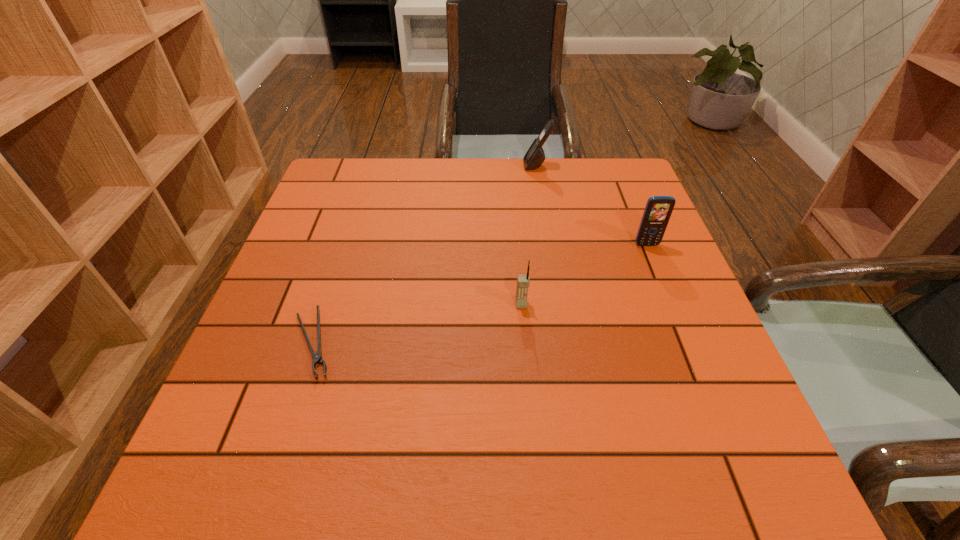
Identify the location of vacant space at the far left corner of the desktop. This screenshot has width=960, height=540. (369, 204).

This screenshot has height=540, width=960. What are the coordinates of `free space at the far right corner of the desktop` in the screenshot? It's located at (584, 185).

Image resolution: width=960 pixels, height=540 pixels. Identify the location of vacant area between the rightmost object and the leftmost object. (479, 294).

Locate an element on the screen. The width and height of the screenshot is (960, 540). free space between the farthest object and the nearest object is located at coordinates (424, 254).

Identify the location of blank region between the leftmost object and the second nearest object. This screenshot has width=960, height=540. (417, 323).

This screenshot has width=960, height=540. I want to click on empty location between the nearest object and the farthest object, so coord(424,254).

At what (x,y) coordinates should I click in order to perform the action: click on free space that is in between the second nearest cellular telephone and the shortest object. Please return your answer as a coordinate pair (x, y). This screenshot has width=960, height=540. Looking at the image, I should click on (479, 294).

Where is `free space between the third farthest object and the leftmost object`? Image resolution: width=960 pixels, height=540 pixels. free space between the third farthest object and the leftmost object is located at coordinates (417, 323).

Where is `vacant space that is in between the rightmost object and the leftmost object`? vacant space that is in between the rightmost object and the leftmost object is located at coordinates (479, 294).

Image resolution: width=960 pixels, height=540 pixels. What are the coordinates of `free spot between the second farthest object and the shortest object` in the screenshot? It's located at (479, 294).